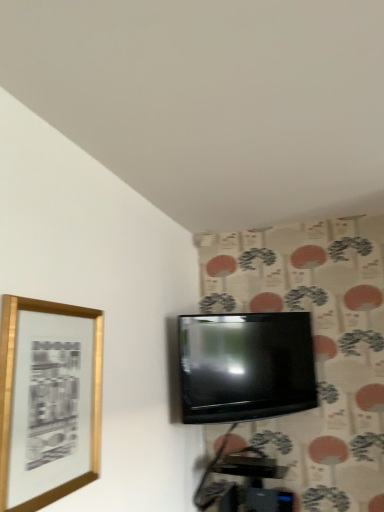
Describe the element at coordinates (48, 401) in the screenshot. Image resolution: width=384 pixels, height=512 pixels. I see `gold metallic picture frame at left` at that location.

The image size is (384, 512). In order to click on gold metallic picture frame at left in this screenshot , I will do `click(48, 401)`.

What is the approximate width of black glossy tv at center?

The width of black glossy tv at center is 8.43 centimeters.

This screenshot has width=384, height=512. Describe the element at coordinates (245, 366) in the screenshot. I see `black glossy tv at center` at that location.

Image resolution: width=384 pixels, height=512 pixels. In order to click on black glossy tv at center in this screenshot , I will do `click(245, 366)`.

You are a GUI agent. You are given a task and a screenshot of the screen. Output one action in this format:
    pyautogui.click(x=<x>, y=<y>)
    Task: Click on the gold metallic picture frame at left
    This screenshot has width=384, height=512.
    Given the screenshot: What is the action you would take?
    pyautogui.click(x=48, y=401)

Is gold metallic picture frame at left to the left of black glossy tv at center from the viewer's perspective?

Correct, you'll find gold metallic picture frame at left to the left of black glossy tv at center.

Is the position of gold metallic picture frame at left less distant than that of black glossy tv at center?

Yes, the depth of gold metallic picture frame at left is less than that of black glossy tv at center.

Is point (76, 426) positioned in front of point (256, 373)?

Yes, it is in front of point (256, 373).

From the image's perspective, is gold metallic picture frame at left located above black glossy tv at center?

Yes.

From a real-world perspective, is gold metallic picture frame at left positioned above or below black glossy tv at center?

gold metallic picture frame at left is situated lower than black glossy tv at center in the real world.

Considering the sizes of objects gold metallic picture frame at left and black glossy tv at center in the image provided, who is wider, gold metallic picture frame at left or black glossy tv at center?

black glossy tv at center.

Between gold metallic picture frame at left and black glossy tv at center, which one has less height?

Standing shorter between the two is black glossy tv at center.

Is gold metallic picture frame at left bigger or smaller than black glossy tv at center?

Clearly, gold metallic picture frame at left is smaller in size than black glossy tv at center.

Is black glossy tv at center located within gold metallic picture frame at left?

No, black glossy tv at center is located outside of gold metallic picture frame at left.

Can you see gold metallic picture frame at left touching black glossy tv at center?

gold metallic picture frame at left is not next to black glossy tv at center, and they're not touching.

Is gold metallic picture frame at left oriented towards black glossy tv at center?

No, gold metallic picture frame at left is not turned towards black glossy tv at center.

How many degrees apart are the facing directions of gold metallic picture frame at left and black glossy tv at center?

50.4 degrees.

This screenshot has width=384, height=512. In order to click on picture frame above the black glossy tv at center (from the image's perspective) in this screenshot , I will do (x=48, y=401).

Based on their positions, is black glossy tv at center located to the left or right of gold metallic picture frame at left?

In the image, black glossy tv at center appears on the right side of gold metallic picture frame at left.

Between black glossy tv at center and gold metallic picture frame at left, which one is positioned in front?

gold metallic picture frame at left is in front.

Which point is more forward, (257, 410) or (29, 339)?

The point (29, 339) is closer to the camera.

From the image's perspective, is black glossy tv at center located above or below gold metallic picture frame at left?

black glossy tv at center is below gold metallic picture frame at left.

From a real-world perspective, is black glossy tv at center located higher than gold metallic picture frame at left?

Correct, in the physical world, black glossy tv at center is higher than gold metallic picture frame at left.

Which of these two, black glossy tv at center or gold metallic picture frame at left, is wider?

black glossy tv at center.

In terms of height, does black glossy tv at center look taller or shorter compared to gold metallic picture frame at left?

Considering their sizes, black glossy tv at center has less height than gold metallic picture frame at left.

Does black glossy tv at center have a smaller size compared to gold metallic picture frame at left?

Incorrect, black glossy tv at center is not smaller in size than gold metallic picture frame at left.

Is black glossy tv at center not inside gold metallic picture frame at left?

Yes.

Can you see black glossy tv at center touching gold metallic picture frame at left?

No, black glossy tv at center is not touching gold metallic picture frame at left.

Could you tell me if black glossy tv at center is turned towards gold metallic picture frame at left?

No.

Locate an element on the screen. picture frame above the black glossy tv at center (from the image's perspective) is located at coordinates (48, 401).

Identify the location of picture frame in front of the black glossy tv at center. (48, 401).

The width and height of the screenshot is (384, 512). I want to click on television lying below the gold metallic picture frame at left (from the image's perspective), so point(245,366).